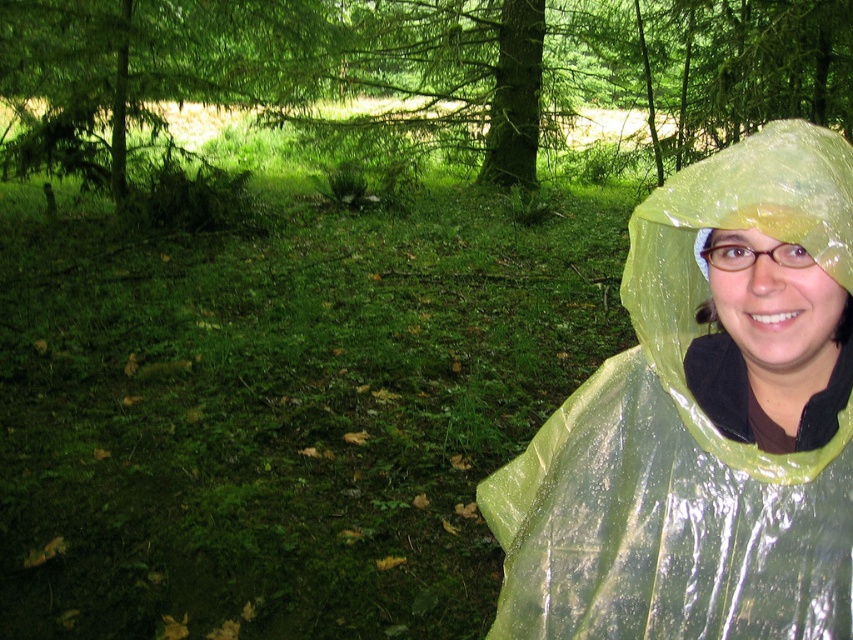
Is transparent yellow raincoat at right above green glossy tree at center?

No.

Who is taller, transparent yellow raincoat at right or green glossy tree at center?

green glossy tree at center

What do you see at coordinates (704, 420) in the screenshot?
I see `transparent yellow raincoat at right` at bounding box center [704, 420].

Where is `transparent yellow raincoat at right`? This screenshot has height=640, width=853. transparent yellow raincoat at right is located at coordinates (704, 420).